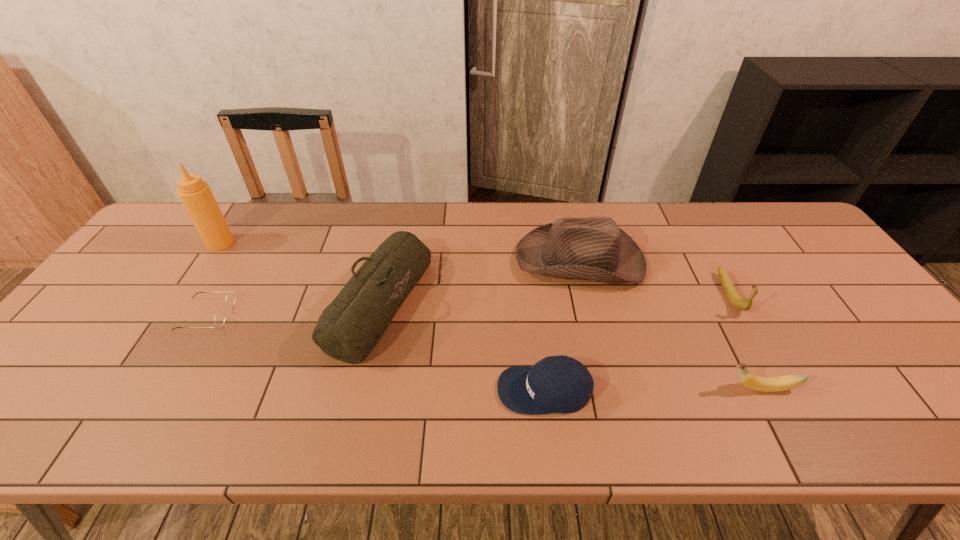
You are a GUI agent. You are given a task and a screenshot of the screen. Output one action in this format:
    pyautogui.click(x=<x>, y=<y>)
    Task: Click on the fedora present at the far edge
    The width and height of the screenshot is (960, 540).
    Given the screenshot: What is the action you would take?
    pyautogui.click(x=592, y=248)

Locate an element on the screen. object present at the near edge is located at coordinates (556, 384).

You are a GUI agent. You are given a task and a screenshot of the screen. Output one action in this format:
    pyautogui.click(x=<x>, y=<y>)
    Task: Click on the free space at the far edge of the desktop
    The height and width of the screenshot is (540, 960).
    Given the screenshot: What is the action you would take?
    pyautogui.click(x=728, y=210)

Image resolution: width=960 pixels, height=540 pixels. I want to click on free location at the near edge, so click(x=429, y=410).

In the image, there is a desktop. What are the coordinates of `vacant region at the left edge` in the screenshot? It's located at (110, 340).

You are a GUI agent. You are given a task and a screenshot of the screen. Output one action in this format:
    pyautogui.click(x=<x>, y=<y>)
    Task: Click on the vacant space at the right edge of the desktop
    
    Given the screenshot: What is the action you would take?
    pyautogui.click(x=832, y=268)

At what (x,y) coordinates should I click in order to perform the action: click on empty space between the condiment and the nearer banana. Please return your answer as a coordinate pair (x, y). This screenshot has height=540, width=960. Looking at the image, I should click on (491, 315).

Where is `vacant area that lies between the baseball cap and the fourth tallest object`? This screenshot has width=960, height=540. vacant area that lies between the baseball cap and the fourth tallest object is located at coordinates (636, 342).

In order to click on free point between the fedora and the shorter banana in this screenshot , I will do `click(670, 325)`.

This screenshot has width=960, height=540. I want to click on vacant area that lies between the third object from left to right and the baseball cap, so click(x=462, y=346).